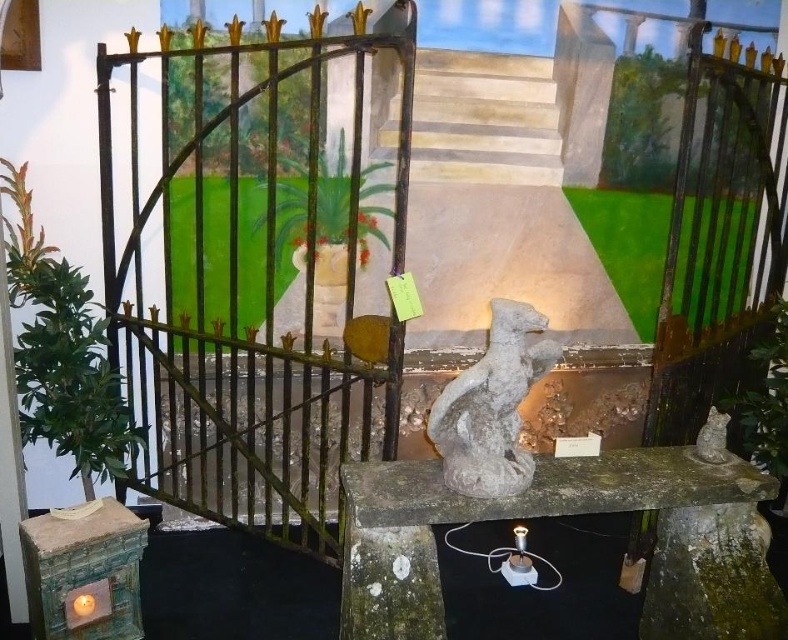
You are standing in front of the display setup and want to place a new decorative item exactly at the point marked by coordinates point (491, 406). Which object from the scene will this point be located on?

The point (491, 406) is located on the gray stone cat at center.